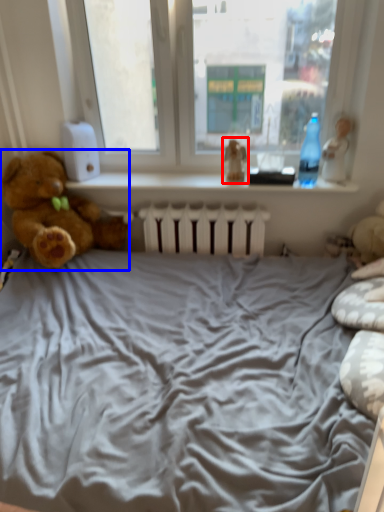
Question: Among these objects, which one is farthest to the camera, toy (highlighted by a red box) or teddy bear (highlighted by a blue box)?

Choices:
 (A) toy
 (B) teddy bear

Answer: (A)